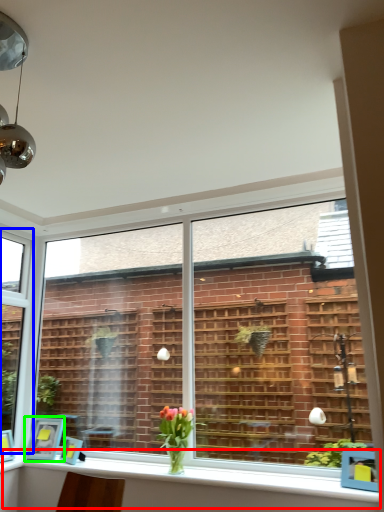
Question: Based on their relative distances, which object is nearer to window sill (highlighted by a red box)? Choose from window (highlighted by a blue box) and picture frame (highlighted by a green box).

Choices:
 (A) window
 (B) picture frame

Answer: (B)